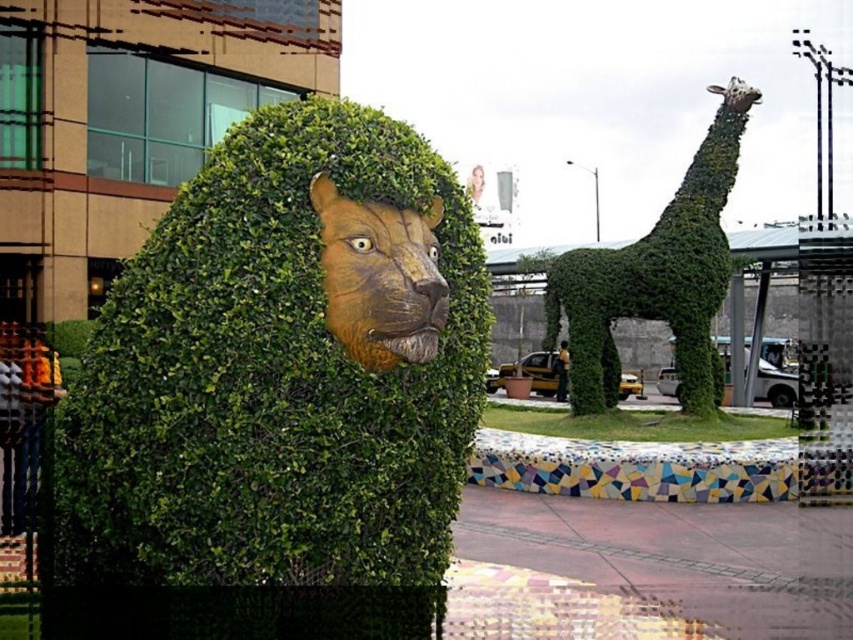
Question: Which of the following is the closest to the observer?

Choices:
 (A) green leafy hedge at center
 (B) brown textured lion head at center
 (C) green leafy giraffe at right

Answer: (B)

Question: Does green leafy hedge at center have a greater width compared to brown textured lion head at center?

Choices:
 (A) yes
 (B) no

Answer: (A)

Question: Estimate the real-world distances between objects in this image. Which object is closer to the brown textured lion head at center?

Choices:
 (A) green leafy giraffe at right
 (B) green leafy hedge at center

Answer: (B)

Question: Can you confirm if green leafy hedge at center is thinner than brown textured lion head at center?

Choices:
 (A) no
 (B) yes

Answer: (A)

Question: Which object is positioned closest to the green leafy giraffe at right?

Choices:
 (A) green leafy hedge at center
 (B) brown textured lion head at center

Answer: (A)

Question: Does green leafy hedge at center lie in front of brown textured lion head at center?

Choices:
 (A) yes
 (B) no

Answer: (B)